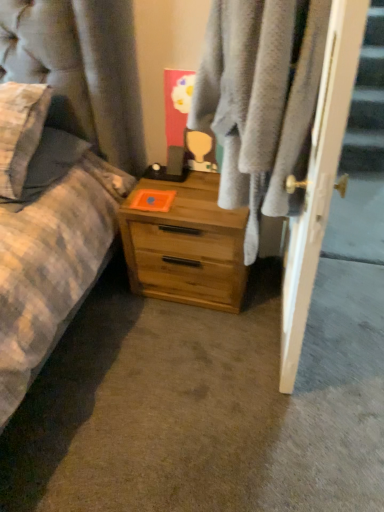
Question: From the image's perspective, would you say soft gray towel at center is positioned over light wood chest of drawers at center?

Choices:
 (A) yes
 (B) no

Answer: (A)

Question: Is soft gray towel at center at the right side of light wood chest of drawers at center?

Choices:
 (A) yes
 (B) no

Answer: (A)

Question: Is the position of soft gray towel at center more distant than that of light wood chest of drawers at center?

Choices:
 (A) yes
 (B) no

Answer: (B)

Question: Can you confirm if soft gray towel at center is taller than light wood chest of drawers at center?

Choices:
 (A) no
 (B) yes

Answer: (B)

Question: Is light wood chest of drawers at center at the back of soft gray towel at center?

Choices:
 (A) no
 (B) yes

Answer: (A)

Question: From a real-world perspective, relative to soft gray towel at center, is white glossy door at right vertically above or below?

Choices:
 (A) below
 (B) above

Answer: (A)

Question: Considering their positions, is white glossy door at right located in front of or behind soft gray towel at center?

Choices:
 (A) behind
 (B) front

Answer: (A)

Question: Considering the positions of white glossy door at right and soft gray towel at center in the image, is white glossy door at right taller or shorter than soft gray towel at center?

Choices:
 (A) tall
 (B) short

Answer: (A)

Question: Choose the correct answer: Is white glossy door at right inside soft gray towel at center or outside it?

Choices:
 (A) inside
 (B) outside

Answer: (B)

Question: From the image's perspective, is light wood chest of drawers at center located above or below soft gray towel at center?

Choices:
 (A) above
 (B) below

Answer: (B)

Question: Relative to soft gray towel at center, is light wood chest of drawers at center in front or behind?

Choices:
 (A) behind
 (B) front

Answer: (A)

Question: Is light wood chest of drawers at center wider or thinner than soft gray towel at center?

Choices:
 (A) thin
 (B) wide

Answer: (B)

Question: Is light wood chest of drawers at center bigger or smaller than soft gray towel at center?

Choices:
 (A) small
 (B) big

Answer: (A)

Question: In the image, is white glossy door at right on the left side or the right side of light wood chest of drawers at center?

Choices:
 (A) right
 (B) left

Answer: (A)

Question: In terms of width, does white glossy door at right look wider or thinner when compared to light wood chest of drawers at center?

Choices:
 (A) thin
 (B) wide

Answer: (A)